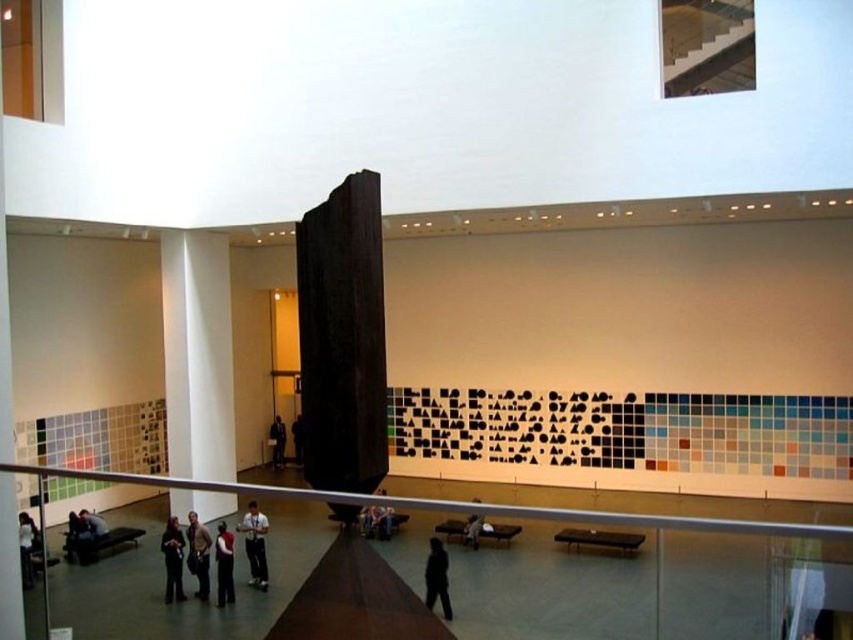
Does dark gray pants at lower left appear on the left side of dark gray suit at lower left?

Incorrect, dark gray pants at lower left is not on the left side of dark gray suit at lower left.

Which is behind, point (175, 540) or point (96, 529)?

The point (96, 529) is more distant.

Between point (166, 531) and point (90, 532), which one is positioned in front?

Point (166, 531) is more forward.

Where is `dark gray pants at lower left`? This screenshot has height=640, width=853. dark gray pants at lower left is located at coordinates (172, 560).

Which is below, white smooth pillar at center or white shirt at center?

white shirt at center

What do you see at coordinates (196, 355) in the screenshot?
I see `white smooth pillar at center` at bounding box center [196, 355].

At what (x,y) coordinates should I click in order to perform the action: click on white smooth pillar at center. Please return your answer as a coordinate pair (x, y). The width and height of the screenshot is (853, 640). Looking at the image, I should click on (196, 355).

Does dark matte figure at center appear under dark gray suit at center?

Incorrect, dark matte figure at center is not positioned below dark gray suit at center.

Who is positioned more to the left, dark matte figure at center or dark gray suit at center?

Positioned to the left is dark gray suit at center.

Does point (430, 536) come farther from viewer compared to point (225, 544)?

No, it is in front of (225, 544).

The height and width of the screenshot is (640, 853). I want to click on dark matte figure at center, so click(436, 577).